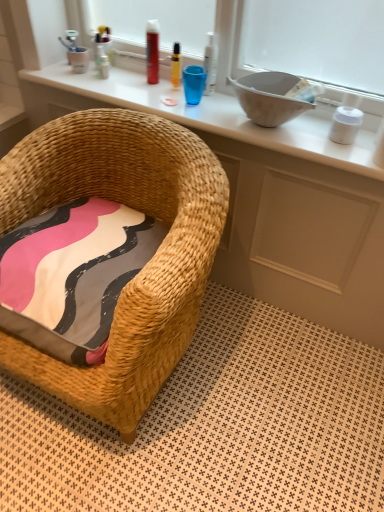
Image resolution: width=384 pixels, height=512 pixels. Identify the location of vacant area to the right of white plastic bottle at upper center, which ranks as the 1th toiletry in left-to-right order. (138, 82).